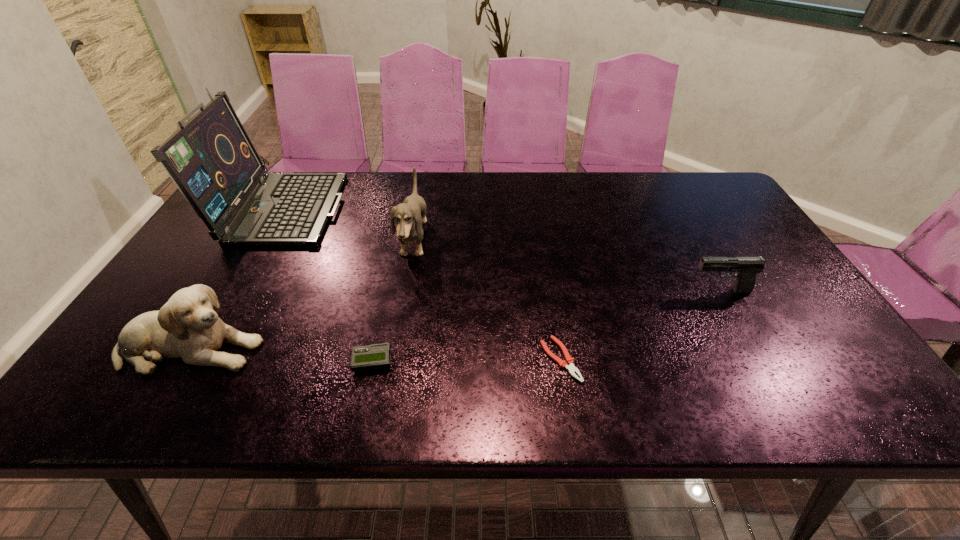
Where is `blank area located 0.200m on the front-facing side of the nearer puppy`? blank area located 0.200m on the front-facing side of the nearer puppy is located at coordinates (350, 348).

The height and width of the screenshot is (540, 960). I want to click on vacant space located aim along the barrel of the fourth nearest object, so click(619, 291).

You are a GUI agent. You are given a task and a screenshot of the screen. Output one action in this format:
    pyautogui.click(x=<x>, y=<y>)
    Task: Click on the vacant space located aim along the barrel of the fourth nearest object
    
    Given the screenshot: What is the action you would take?
    pyautogui.click(x=639, y=291)

The width and height of the screenshot is (960, 540). In order to click on free space located aim along the barrel of the fourth nearest object in this screenshot , I will do `click(659, 291)`.

Locate an element on the screen. The height and width of the screenshot is (540, 960). vacant region located on the back of the beeper is located at coordinates (392, 272).

Locate an element on the screen. The image size is (960, 540). vacant space located on the back of the pliers is located at coordinates (541, 242).

The width and height of the screenshot is (960, 540). I want to click on laptop computer located at the far edge, so click(x=210, y=158).

Where is `puppy at the far edge`? puppy at the far edge is located at coordinates (409, 215).

You are a GUI agent. You are given a task and a screenshot of the screen. Output one action in this format:
    pyautogui.click(x=<x>, y=<y>)
    Task: Click on the puppy located at the near edge
    
    Given the screenshot: What is the action you would take?
    pyautogui.click(x=187, y=327)

The height and width of the screenshot is (540, 960). What are the coordinates of `pliers at the near edge` in the screenshot? It's located at (569, 363).